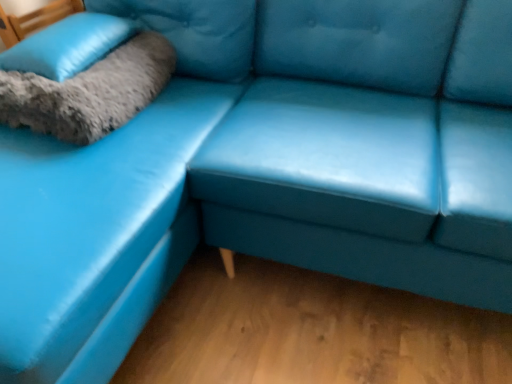
Question: Is gray fluffy pillow at upper left far from soft gray fur pillow at upper left?

Choices:
 (A) yes
 (B) no

Answer: (B)

Question: Is gray fluffy pillow at upper left turned away from soft gray fur pillow at upper left?

Choices:
 (A) yes
 (B) no

Answer: (B)

Question: Is gray fluffy pillow at upper left not within soft gray fur pillow at upper left?

Choices:
 (A) no
 (B) yes

Answer: (B)

Question: Is gray fluffy pillow at upper left at the right side of soft gray fur pillow at upper left?

Choices:
 (A) no
 (B) yes

Answer: (B)

Question: From a real-world perspective, does gray fluffy pillow at upper left sit lower than soft gray fur pillow at upper left?

Choices:
 (A) no
 (B) yes

Answer: (B)

Question: From a real-world perspective, relative to matte blue leather couch at center, is soft gray fur pillow at upper left vertically above or below?

Choices:
 (A) above
 (B) below

Answer: (A)

Question: Choose the correct answer: Is soft gray fur pillow at upper left inside matte blue leather couch at center or outside it?

Choices:
 (A) inside
 (B) outside

Answer: (A)

Question: Relative to matte blue leather couch at center, is soft gray fur pillow at upper left in front or behind?

Choices:
 (A) behind
 (B) front

Answer: (A)

Question: Is soft gray fur pillow at upper left taller or shorter than matte blue leather couch at center?

Choices:
 (A) short
 (B) tall

Answer: (A)

Question: Which is correct: gray fluffy pillow at upper left is inside matte blue leather couch at center, or outside of it?

Choices:
 (A) outside
 (B) inside

Answer: (B)

Question: From a real-world perspective, relative to matte blue leather couch at center, is gray fluffy pillow at upper left vertically above or below?

Choices:
 (A) above
 (B) below

Answer: (A)

Question: In terms of width, does gray fluffy pillow at upper left look wider or thinner when compared to matte blue leather couch at center?

Choices:
 (A) wide
 (B) thin

Answer: (B)

Question: In terms of height, does gray fluffy pillow at upper left look taller or shorter compared to matte blue leather couch at center?

Choices:
 (A) short
 (B) tall

Answer: (A)

Question: In the image, is soft gray fur pillow at upper left positioned in front of or behind gray fluffy pillow at upper left?

Choices:
 (A) behind
 (B) front

Answer: (A)

Question: Considering the positions of soft gray fur pillow at upper left and gray fluffy pillow at upper left in the image, is soft gray fur pillow at upper left bigger or smaller than gray fluffy pillow at upper left?

Choices:
 (A) small
 (B) big

Answer: (A)